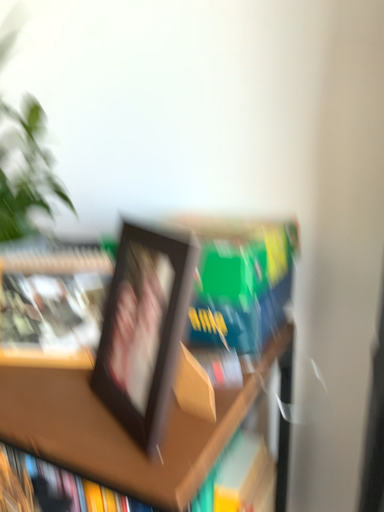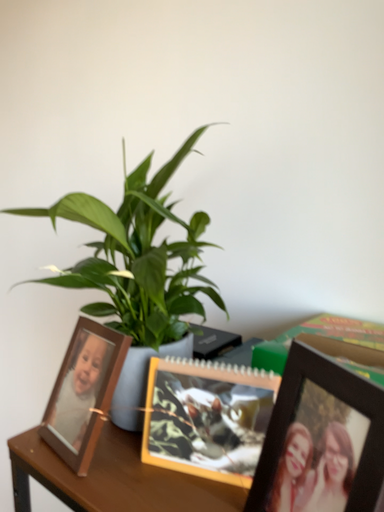
Question: Which way did the camera rotate in the video?

Choices:
 (A) rotated upward
 (B) rotated downward

Answer: (A)